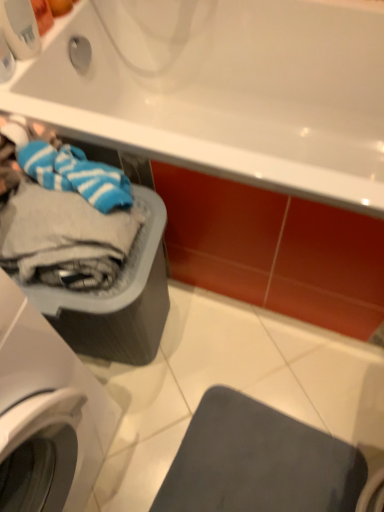
Question: Does white plastic washing machine at left have a greater height compared to white glossy bathtub at upper center?

Choices:
 (A) yes
 (B) no

Answer: (A)

Question: Can you confirm if white plastic washing machine at left is thinner than white glossy bathtub at upper center?

Choices:
 (A) no
 (B) yes

Answer: (B)

Question: Is white plastic washing machine at left wider than white glossy bathtub at upper center?

Choices:
 (A) no
 (B) yes

Answer: (A)

Question: Is white plastic washing machine at left looking in the opposite direction of white glossy bathtub at upper center?

Choices:
 (A) yes
 (B) no

Answer: (B)

Question: Is white plastic washing machine at left positioned far away from white glossy bathtub at upper center?

Choices:
 (A) yes
 (B) no

Answer: (B)

Question: In terms of width, does white glossy bathtub at upper center look wider or thinner when compared to matte gray plastic basket at lower left?

Choices:
 (A) wide
 (B) thin

Answer: (A)

Question: Do you think white glossy bathtub at upper center is within matte gray plastic basket at lower left, or outside of it?

Choices:
 (A) outside
 (B) inside

Answer: (A)

Question: Relative to matte gray plastic basket at lower left, is white glossy bathtub at upper center in front or behind?

Choices:
 (A) behind
 (B) front

Answer: (B)

Question: In terms of size, does white glossy bathtub at upper center appear bigger or smaller than matte gray plastic basket at lower left?

Choices:
 (A) small
 (B) big

Answer: (B)

Question: Choose the correct answer: Is matte gray mat at lower right inside matte gray plastic basket at lower left or outside it?

Choices:
 (A) outside
 (B) inside

Answer: (A)

Question: Is point (268, 488) closer or farther from the camera than point (144, 246)?

Choices:
 (A) farther
 (B) closer

Answer: (A)

Question: From a real-world perspective, is matte gray mat at lower right positioned above or below matte gray plastic basket at lower left?

Choices:
 (A) below
 (B) above

Answer: (A)

Question: Considering the positions of matte gray mat at lower right and matte gray plastic basket at lower left in the image, is matte gray mat at lower right bigger or smaller than matte gray plastic basket at lower left?

Choices:
 (A) small
 (B) big

Answer: (A)

Question: Is matte gray mat at lower right spatially inside white plastic washing machine at left, or outside of it?

Choices:
 (A) outside
 (B) inside

Answer: (A)

Question: Is matte gray mat at lower right taller or shorter than white plastic washing machine at left?

Choices:
 (A) short
 (B) tall

Answer: (A)